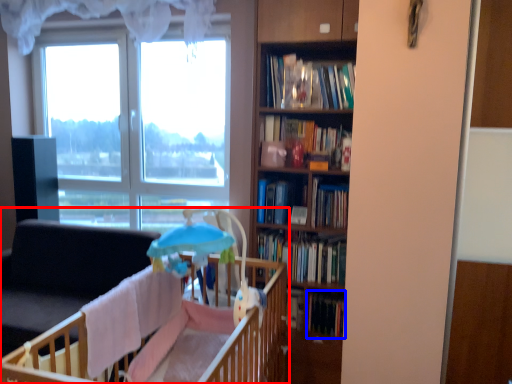
Question: Which object appears closest to the camera in this image, infant bed (highlighted by a red box) or book (highlighted by a blue box)?

Choices:
 (A) infant bed
 (B) book

Answer: (A)